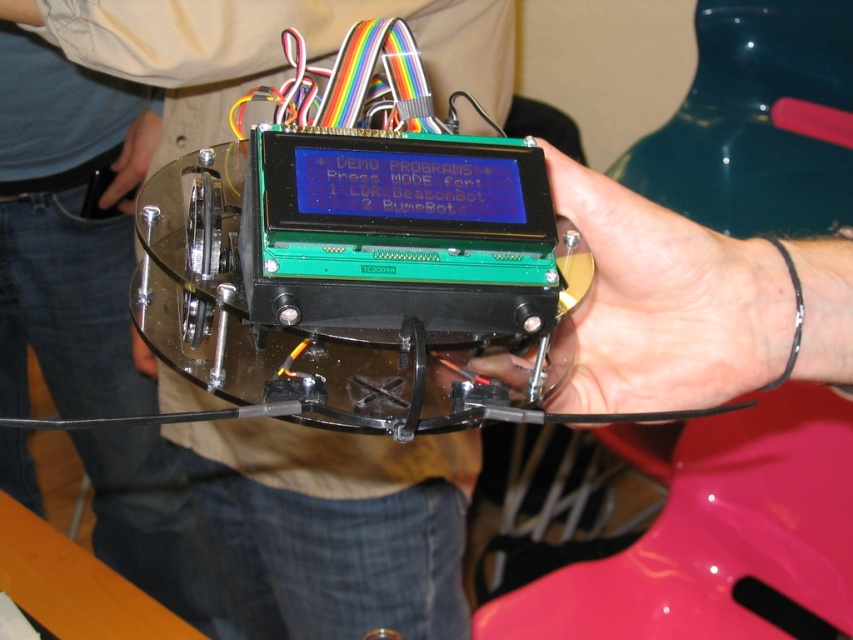
You are holding the device and need to determine which part is taller between the matte black laptop at center and the green matte lcd screen at center. Which one is taller?

The matte black laptop at center is much taller than the green matte lcd screen at center according to the description.

What are the coordinates of the matte black laptop at center in the image?

The coordinates of the matte black laptop at center are at point (287, 524).